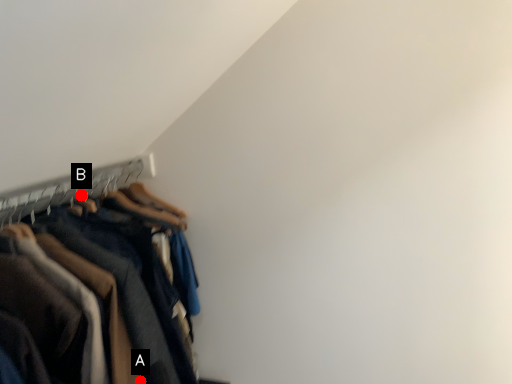
Question: Two points are circled on the image, labeled by A and B beside each circle. Which of the following is the closest to the observer?

Choices:
 (A) A is closer
 (B) B is closer

Answer: (A)